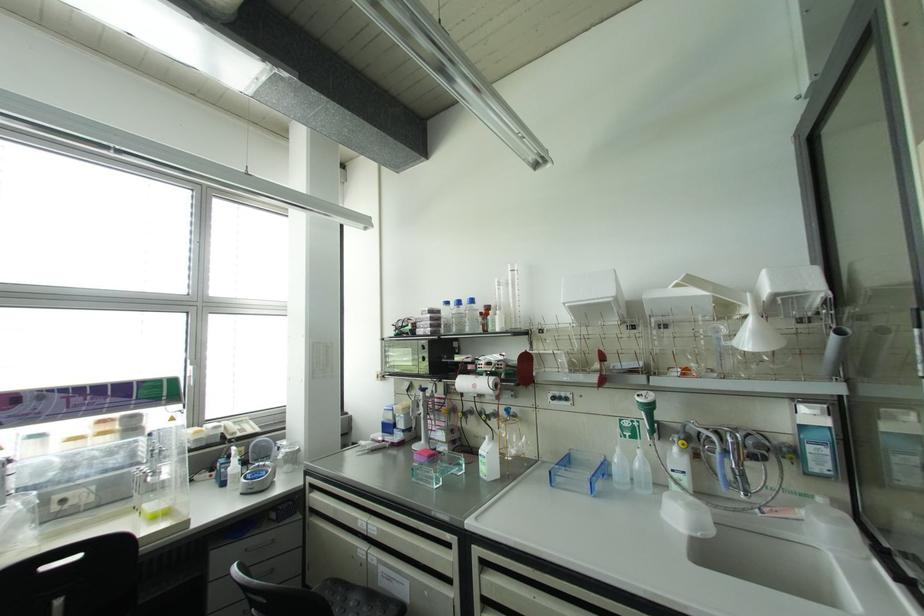
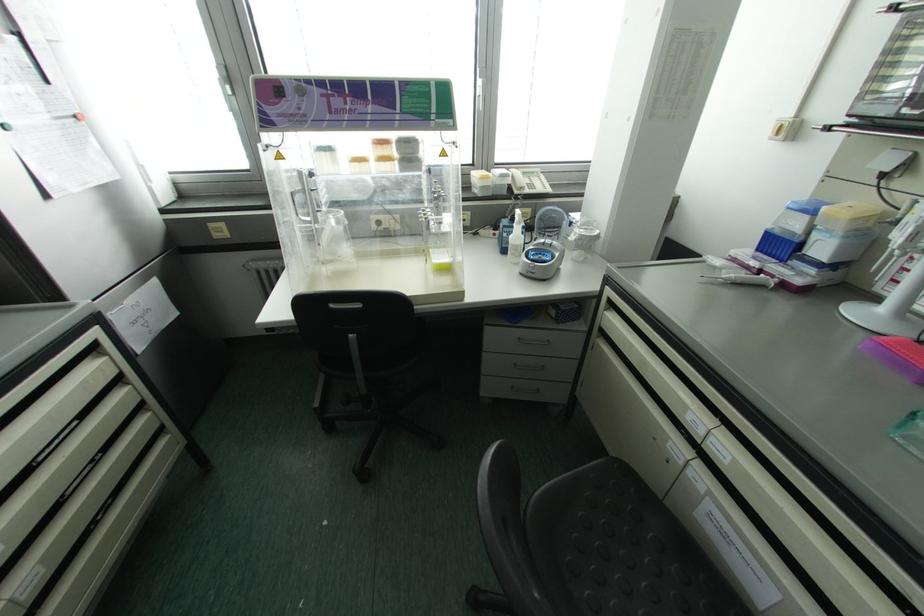
Find the pixel in the second image that matches pixel 62 390 in the first image.

(320, 82)